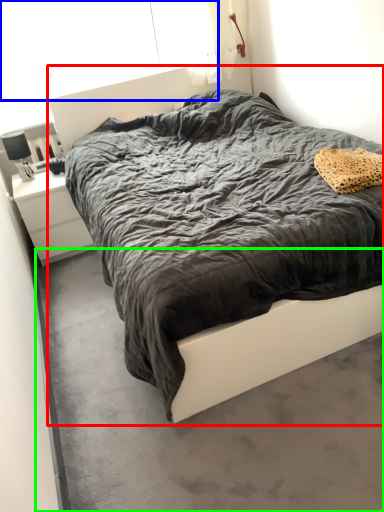
Question: Based on their relative distances, which object is farther from bed (highlighted by a red box)? Choose from window screen (highlighted by a blue box) and concrete (highlighted by a green box).

Choices:
 (A) window screen
 (B) concrete

Answer: (A)